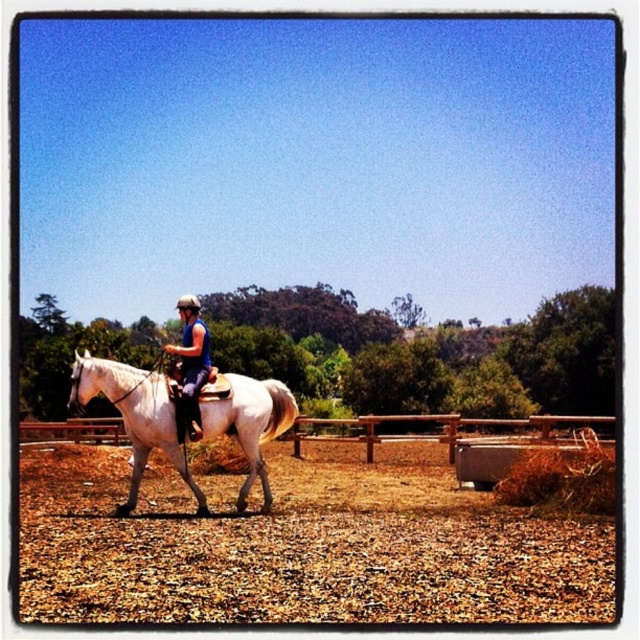
Who is shorter, white glossy horse at center or blue fabric helmet at center?

blue fabric helmet at center is shorter.

Can you confirm if white glossy horse at center is shorter than blue fabric helmet at center?

No.

Does point (154, 445) lie behind point (182, 296)?

No, it is in front of (182, 296).

Locate an element on the screen. Image resolution: width=640 pixels, height=640 pixels. white glossy horse at center is located at coordinates (132, 413).

Does brown wooden fence at center have a greater width compared to white glossy horse at center?

Yes.

Find the location of a particular element. The height and width of the screenshot is (640, 640). brown wooden fence at center is located at coordinates (456, 436).

Find the location of `brown wooden fence at center`. brown wooden fence at center is located at coordinates (456, 436).

Can you confirm if brown gravelly dirt at center is positioned to the right of brown wooden fence at center?

Correct, you'll find brown gravelly dirt at center to the right of brown wooden fence at center.

Who is shorter, brown gravelly dirt at center or brown wooden fence at center?

brown gravelly dirt at center

The width and height of the screenshot is (640, 640). Identify the location of brown gravelly dirt at center. (300, 545).

Identify the location of brown gravelly dirt at center. This screenshot has width=640, height=640. (300, 545).